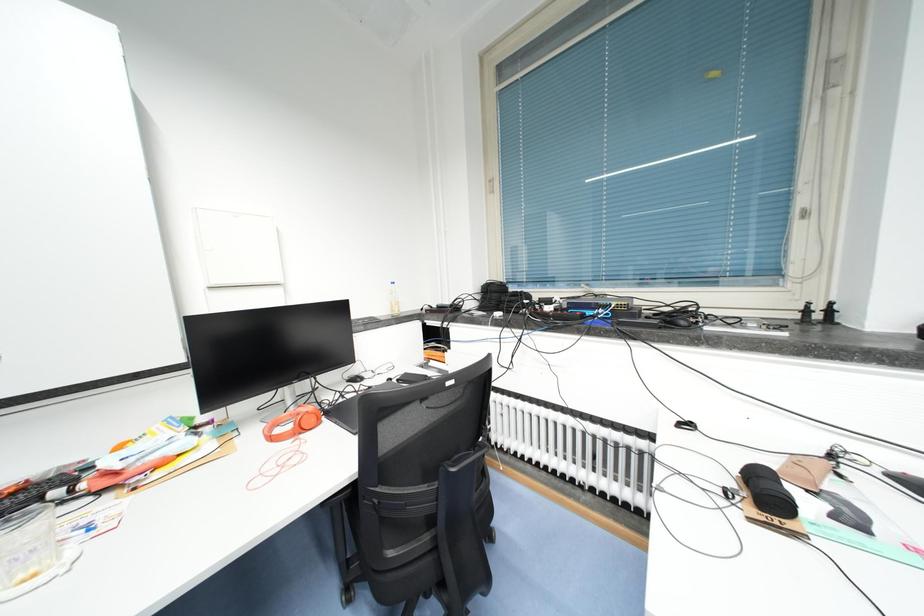
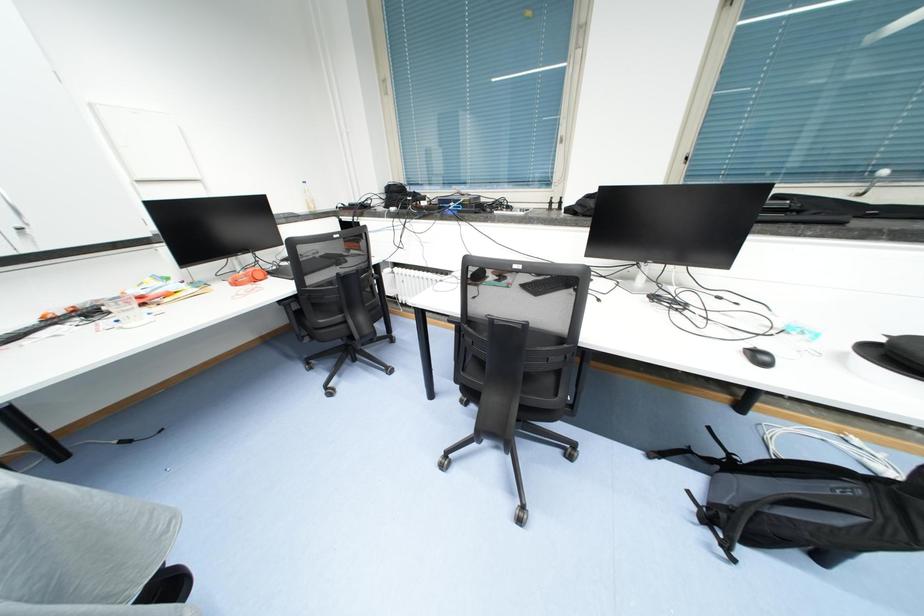
Question: The images are taken continuously from a first-person perspective. In which direction is your viewpoint rotating?

Choices:
 (A) Left
 (B) Right
 (C) Up
 (D) Down

Answer: (D)